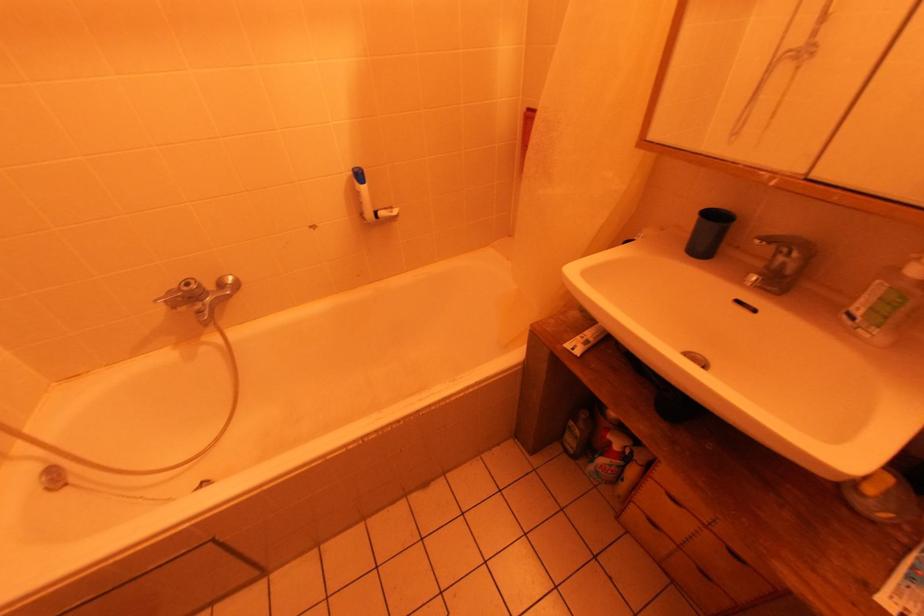
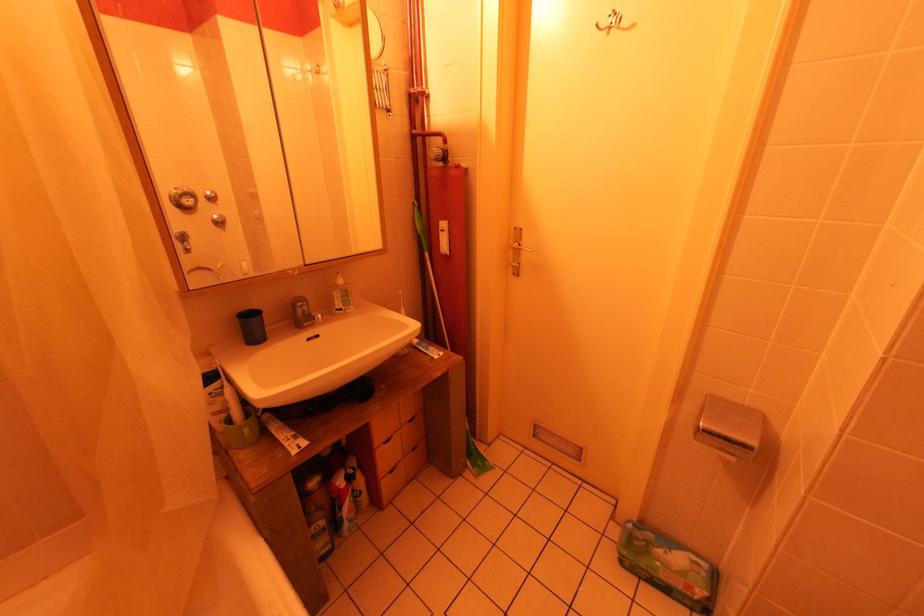
The images are taken continuously from a first-person perspective. In which direction is your viewpoint rotating?

The rotation direction of the camera is right-down.